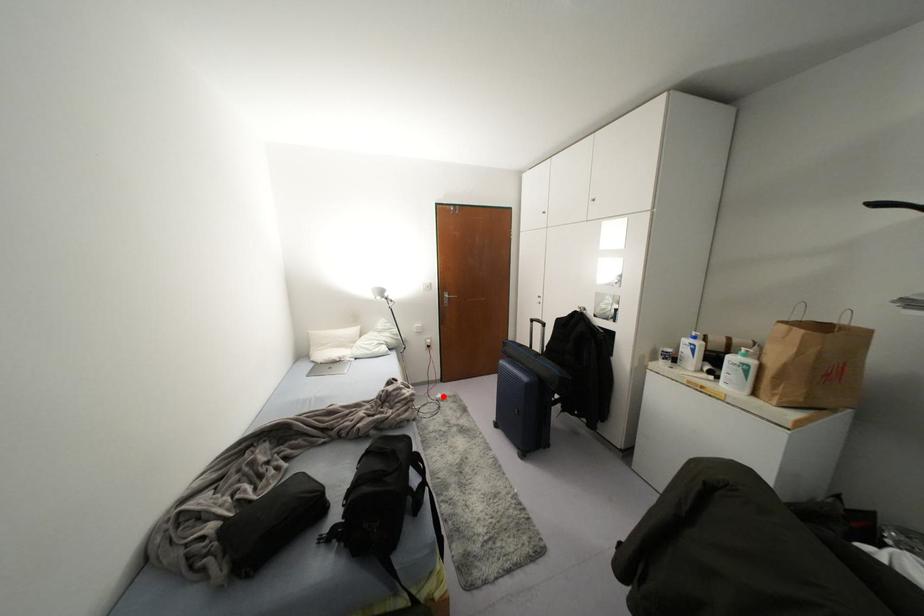
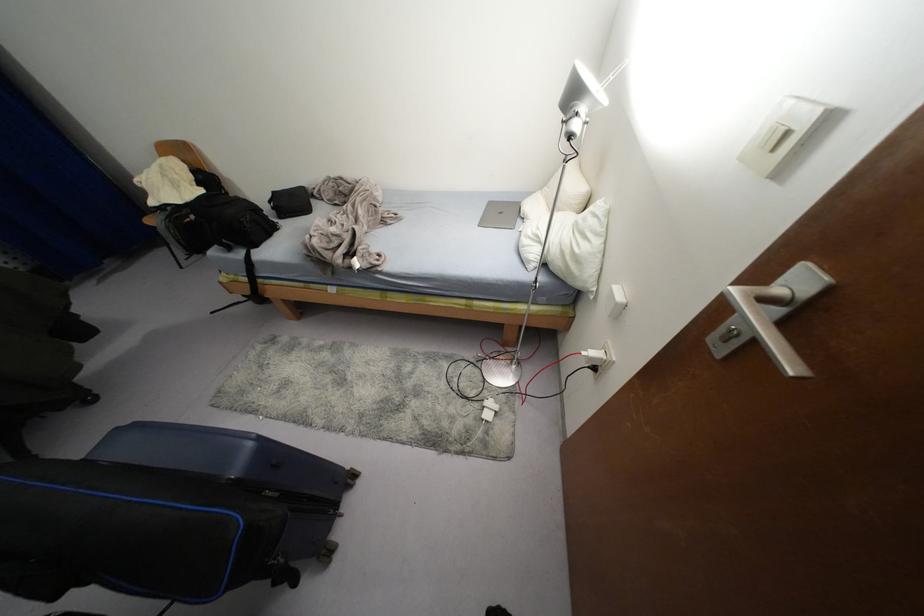
Question: I am providing you with two images of the same scene from different viewpoints. Image1 has a red point marked. In image2, the corresponding 3D location appears at what relative position? Reply with the corresponding letter.

Choices:
 (A) Closer
 (B) Farther

Answer: (B)